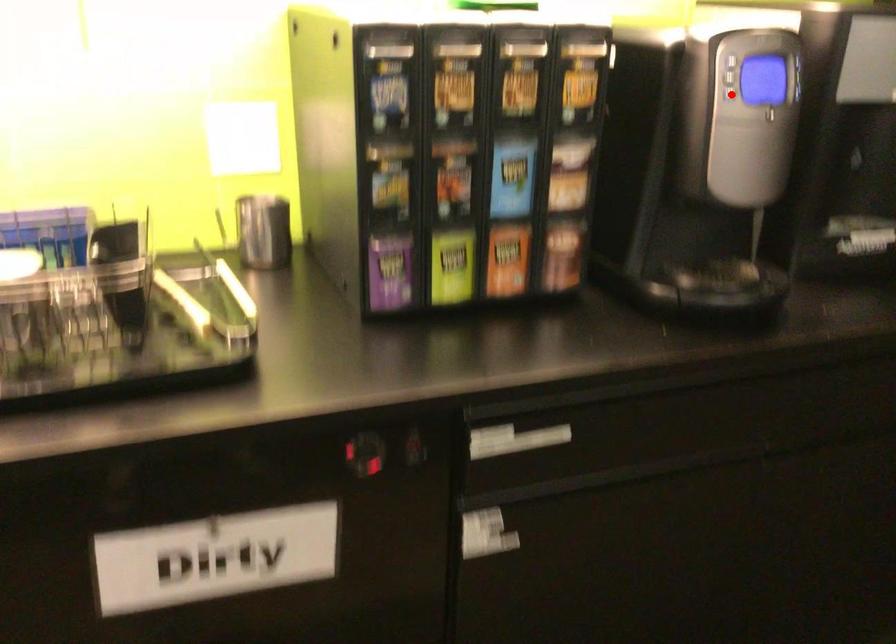
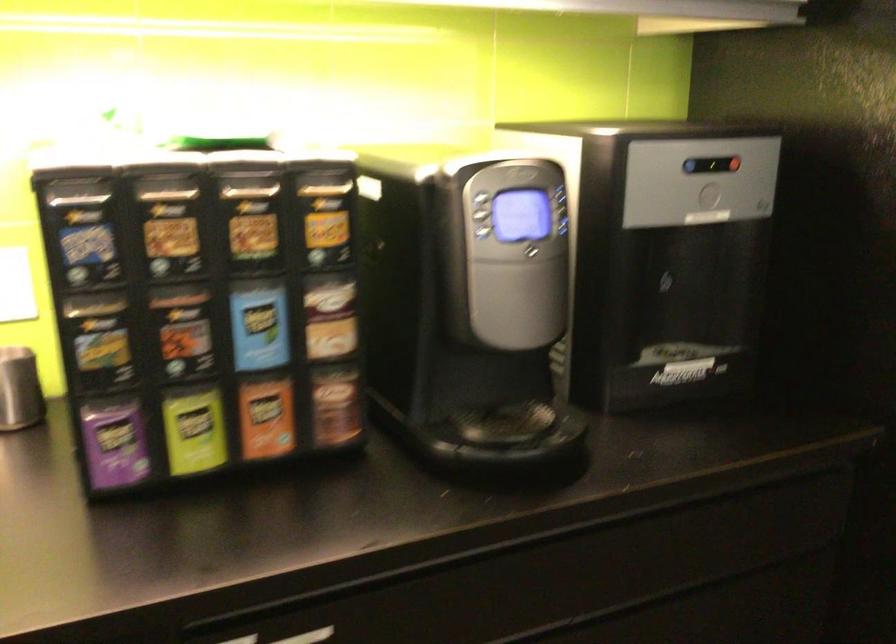
Find the pixel in the second image that matches the highlighted location in the first image.

(486, 232)